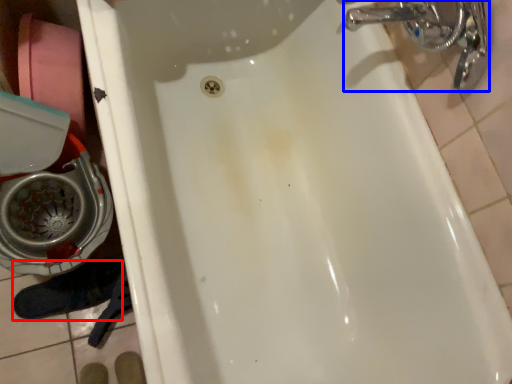
Question: Which of the following is the farthest to the observer, shoe (highlighted by a red box) or plumbing fixture (highlighted by a blue box)?

Choices:
 (A) shoe
 (B) plumbing fixture

Answer: (A)